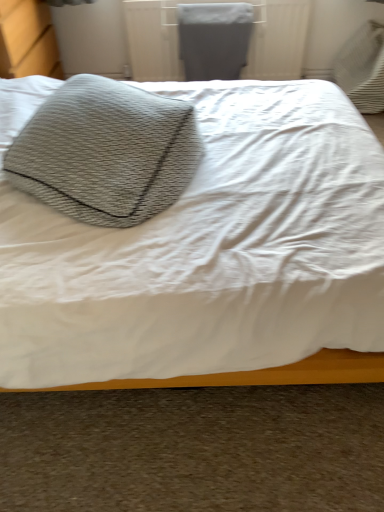
The image size is (384, 512). Describe the element at coordinates (213, 258) in the screenshot. I see `textured gray pillow at upper left` at that location.

What do you see at coordinates (214, 40) in the screenshot?
I see `matte gray radiator at upper center` at bounding box center [214, 40].

At what (x,y) coordinates should I click in order to perform the action: click on textured gray pillow at upper left. Please return your answer as a coordinate pair (x, y). This screenshot has height=512, width=384. Looking at the image, I should click on (106, 152).

At what (x,y) coordinates should I click in order to perform the action: click on textured gray pillow at upper left. Please return your answer as a coordinate pair (x, y). This screenshot has width=384, height=512. Looking at the image, I should click on (213, 258).

Which object is positioned more to the right, matte gray radiator at upper center or textured gray pillow at upper left?

matte gray radiator at upper center is more to the right.

From the image's perspective, relative to textured gray pillow at upper left, is matte gray radiator at upper center above or below?

Clearly, from the image's perspective, matte gray radiator at upper center is above textured gray pillow at upper left.

From a real-world perspective, which is physically below, matte gray radiator at upper center or textured gray pillow at upper left?

matte gray radiator at upper center is physically lower.

In the scene shown: Which is correct: matte gray radiator at upper center is inside textured gray pillow at upper left, or outside of it?

matte gray radiator at upper center is outside textured gray pillow at upper left.

Looking at this image, from the image's perspective, does textured gray pillow at upper left appear lower than textured gray pillow at upper left?

Yes, from the image's perspective, textured gray pillow at upper left is beneath textured gray pillow at upper left.

How much distance is there between textured gray pillow at upper left and textured gray pillow at upper left?

textured gray pillow at upper left and textured gray pillow at upper left are 27.39 centimeters apart from each other.

The height and width of the screenshot is (512, 384). I want to click on bed lying below the textured gray pillow at upper left (from the image's perspective), so click(213, 258).

Can you confirm if textured gray pillow at upper left is shorter than textured gray pillow at upper left?

No, textured gray pillow at upper left is not shorter than textured gray pillow at upper left.

Could you tell me if textured gray pillow at upper left is turned towards textured gray pillow at upper left?

Yes, textured gray pillow at upper left is facing textured gray pillow at upper left.

From a real-world perspective, which is physically below, textured gray pillow at upper left or textured gray pillow at upper left?

In real-world perspective, textured gray pillow at upper left is lower.

From the image's perspective, is textured gray pillow at upper left located above or below textured gray pillow at upper left?

Based on their image positions, textured gray pillow at upper left is located above textured gray pillow at upper left.

Is textured gray pillow at upper left not near matte gray radiator at upper center?

Yes, textured gray pillow at upper left and matte gray radiator at upper center are located far from each other.

Considering the positions of objects textured gray pillow at upper left and matte gray radiator at upper center in the image provided, who is more to the right, textured gray pillow at upper left or matte gray radiator at upper center?

matte gray radiator at upper center.

From a real-world perspective, is textured gray pillow at upper left located beneath matte gray radiator at upper center?

No, from a real-world perspective, textured gray pillow at upper left is not beneath matte gray radiator at upper center.

In terms of size, does textured gray pillow at upper left appear bigger or smaller than matte gray radiator at upper center?

Considering their sizes, textured gray pillow at upper left takes up more space than matte gray radiator at upper center.

Is textured gray pillow at upper left located within matte gray radiator at upper center?

No, textured gray pillow at upper left is not inside matte gray radiator at upper center.

Considering the sizes of matte gray radiator at upper center and textured gray pillow at upper left in the image, is matte gray radiator at upper center wider or thinner than textured gray pillow at upper left?

Considering their sizes, matte gray radiator at upper center looks slimmer than textured gray pillow at upper left.

Looking at this image, from the image's perspective, is matte gray radiator at upper center below textured gray pillow at upper left?

No.

From a real-world perspective, is matte gray radiator at upper center physically located above or below textured gray pillow at upper left?

matte gray radiator at upper center is below textured gray pillow at upper left.

From the image's perspective, is textured gray pillow at upper left located above matte gray radiator at upper center?

Incorrect, from the image's perspective, textured gray pillow at upper left is lower than matte gray radiator at upper center.

Is textured gray pillow at upper left oriented away from matte gray radiator at upper center?

No, textured gray pillow at upper left is not facing away from matte gray radiator at upper center.

Considering the positions of objects textured gray pillow at upper left and matte gray radiator at upper center in the image provided, who is behind, textured gray pillow at upper left or matte gray radiator at upper center?

Positioned behind is matte gray radiator at upper center.

Which object is positioned more to the left, textured gray pillow at upper left or matte gray radiator at upper center?

textured gray pillow at upper left is more to the left.

Where is `gray that is above the textured gray pillow at upper left (from the image's perspective)`? gray that is above the textured gray pillow at upper left (from the image's perspective) is located at coordinates (214, 40).

The width and height of the screenshot is (384, 512). Identify the location of throw pillow above the textured gray pillow at upper left (from a real-world perspective). (106, 152).

From the picture: Based on their spatial positions, is textured gray pillow at upper left or matte gray radiator at upper center further from textured gray pillow at upper left?

The object further to textured gray pillow at upper left is matte gray radiator at upper center.

From the image, which object appears to be farther from matte gray radiator at upper center, textured gray pillow at upper left or textured gray pillow at upper left?

textured gray pillow at upper left is positioned further to the anchor matte gray radiator at upper center.

Based on their spatial positions, is textured gray pillow at upper left or textured gray pillow at upper left closer to matte gray radiator at upper center?

textured gray pillow at upper left.

Based on their spatial positions, is matte gray radiator at upper center or textured gray pillow at upper left further from textured gray pillow at upper left?

matte gray radiator at upper center.

In the scene shown: Based on their spatial positions, is textured gray pillow at upper left or matte gray radiator at upper center closer to textured gray pillow at upper left?

textured gray pillow at upper left is positioned closer to the anchor textured gray pillow at upper left.

Which object lies nearer to the anchor point textured gray pillow at upper left, matte gray radiator at upper center or textured gray pillow at upper left?

Among the two, textured gray pillow at upper left is located nearer to textured gray pillow at upper left.

Find the location of a particular element. The image size is (384, 512). throw pillow between textured gray pillow at upper left and matte gray radiator at upper center in the front-back direction is located at coordinates (106, 152).